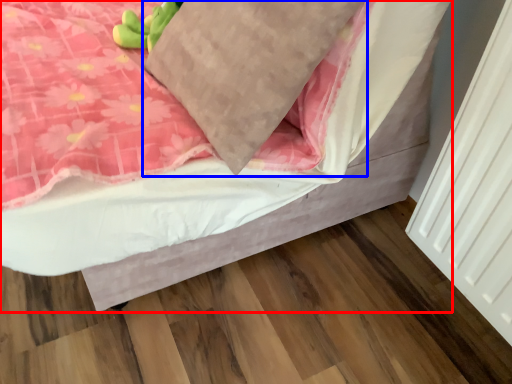
Question: Among these objects, which one is nearest to the camera, bed (highlighted by a red box) or pillow (highlighted by a blue box)?

Choices:
 (A) bed
 (B) pillow

Answer: (A)